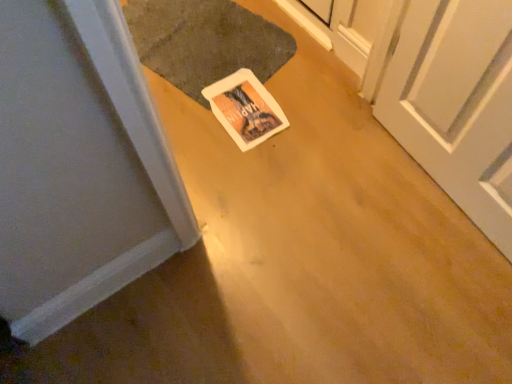
Question: From the image's perspective, would you say white paper postcard at center is shown under dark gray textured mat at center?

Choices:
 (A) no
 (B) yes

Answer: (B)

Question: Is dark gray textured mat at center located within white paper postcard at center?

Choices:
 (A) yes
 (B) no

Answer: (B)

Question: Considering the relative sizes of white paper postcard at center and dark gray textured mat at center in the image provided, is white paper postcard at center bigger than dark gray textured mat at center?

Choices:
 (A) no
 (B) yes

Answer: (A)

Question: Considering the relative sizes of white paper postcard at center and dark gray textured mat at center in the image provided, is white paper postcard at center smaller than dark gray textured mat at center?

Choices:
 (A) no
 (B) yes

Answer: (B)

Question: Considering the relative positions of white paper postcard at center and dark gray textured mat at center in the image provided, is white paper postcard at center behind dark gray textured mat at center?

Choices:
 (A) yes
 (B) no

Answer: (B)

Question: Is white paper postcard at center positioned beyond the bounds of dark gray textured mat at center?

Choices:
 (A) yes
 (B) no

Answer: (B)

Question: Is dark gray textured mat at center positioned beyond the bounds of white paper postcard at center?

Choices:
 (A) yes
 (B) no

Answer: (A)

Question: Are dark gray textured mat at center and white paper postcard at center making contact?

Choices:
 (A) no
 (B) yes

Answer: (A)

Question: Is dark gray textured mat at center bigger than white paper postcard at center?

Choices:
 (A) no
 (B) yes

Answer: (B)

Question: Considering the relative sizes of dark gray textured mat at center and white paper postcard at center in the image provided, is dark gray textured mat at center wider than white paper postcard at center?

Choices:
 (A) no
 (B) yes

Answer: (B)

Question: Is dark gray textured mat at center behind white paper postcard at center?

Choices:
 (A) no
 (B) yes

Answer: (B)

Question: Is the depth of dark gray textured mat at center less than that of white paper postcard at center?

Choices:
 (A) yes
 (B) no

Answer: (B)

Question: Is white paper postcard at center wider or thinner than dark gray textured mat at center?

Choices:
 (A) wide
 (B) thin

Answer: (B)